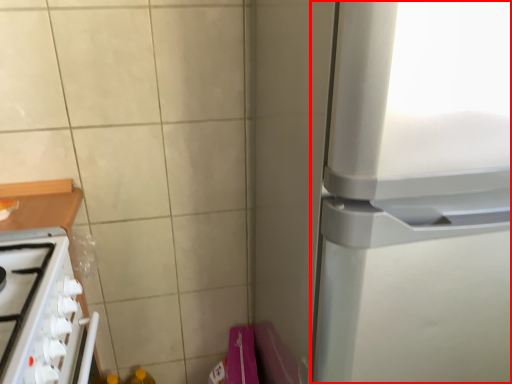
Question: Considering the relative positions of refrigerator (annotated by the red box) and home appliance in the image provided, where is refrigerator (annotated by the red box) located with respect to the staircase?

Choices:
 (A) left
 (B) right

Answer: (B)